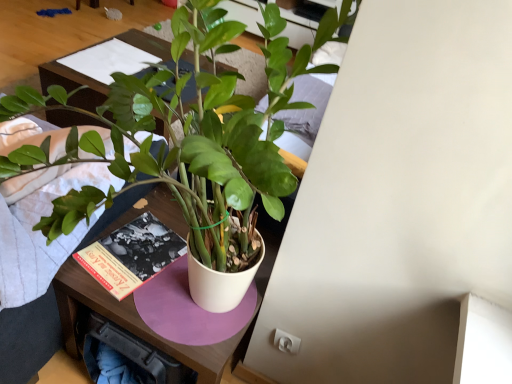
Question: Can you confirm if matte wood table at center is positioned to the right of green glossy plant at center?

Choices:
 (A) yes
 (B) no

Answer: (B)

Question: Is matte wood table at center smaller than green glossy plant at center?

Choices:
 (A) no
 (B) yes

Answer: (B)

Question: Is matte wood table at center shorter than green glossy plant at center?

Choices:
 (A) yes
 (B) no

Answer: (A)

Question: From a real-world perspective, is matte wood table at center positioned over green glossy plant at center based on gravity?

Choices:
 (A) yes
 (B) no

Answer: (B)

Question: Is matte wood table at center facing towards green glossy plant at center?

Choices:
 (A) no
 (B) yes

Answer: (A)

Question: From the image's perspective, is matte wood table at center located above green glossy plant at center?

Choices:
 (A) no
 (B) yes

Answer: (B)

Question: Considering the relative sizes of green glossy plant at center and matte wood table at center in the image provided, is green glossy plant at center thinner than matte wood table at center?

Choices:
 (A) yes
 (B) no

Answer: (B)

Question: Is green glossy plant at center to the right of matte wood table at center from the viewer's perspective?

Choices:
 (A) yes
 (B) no

Answer: (A)

Question: From the image's perspective, does green glossy plant at center appear lower than matte wood table at center?

Choices:
 (A) yes
 (B) no

Answer: (A)

Question: Could you tell me if green glossy plant at center is turned towards matte wood table at center?

Choices:
 (A) yes
 (B) no

Answer: (B)

Question: Can you confirm if green glossy plant at center is taller than matte wood table at center?

Choices:
 (A) no
 (B) yes

Answer: (B)

Question: Can you confirm if green glossy plant at center is shorter than matte wood table at center?

Choices:
 (A) no
 (B) yes

Answer: (A)

Question: Is point (122, 41) closer or farther from the camera than point (234, 198)?

Choices:
 (A) closer
 (B) farther

Answer: (B)